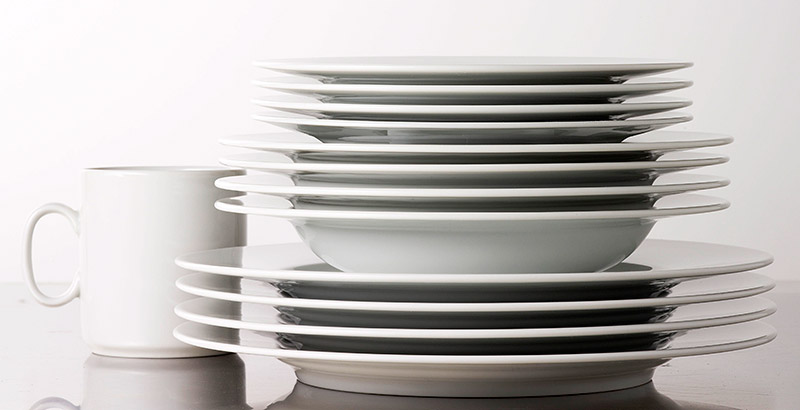
This screenshot has height=410, width=800. What are the coordinates of `plates` in the screenshot? It's located at (418, 65), (420, 85), (436, 110), (442, 124), (450, 286), (454, 303), (454, 340), (452, 361).